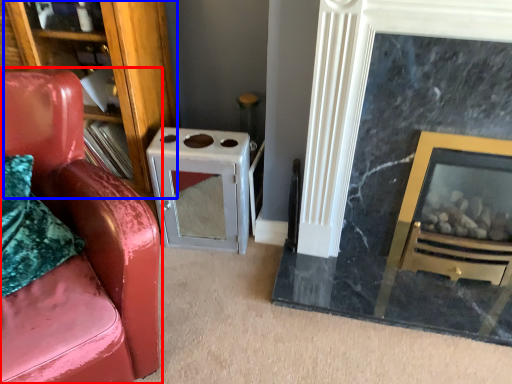
Question: Which object is closer to the camera taking this photo, chair (highlighted by a red box) or bookshelf (highlighted by a blue box)?

Choices:
 (A) chair
 (B) bookshelf

Answer: (A)